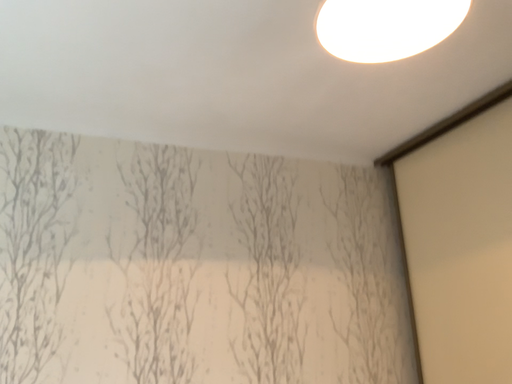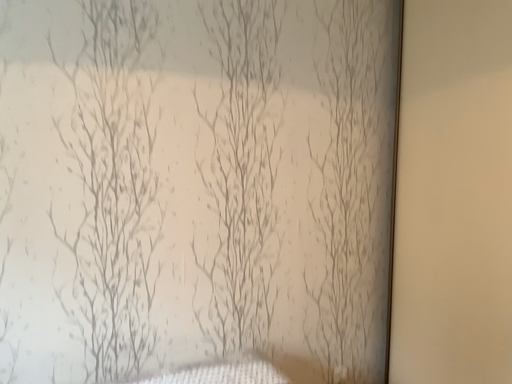
Question: Which way did the camera rotate in the video?

Choices:
 (A) rotated upward
 (B) rotated downward

Answer: (B)